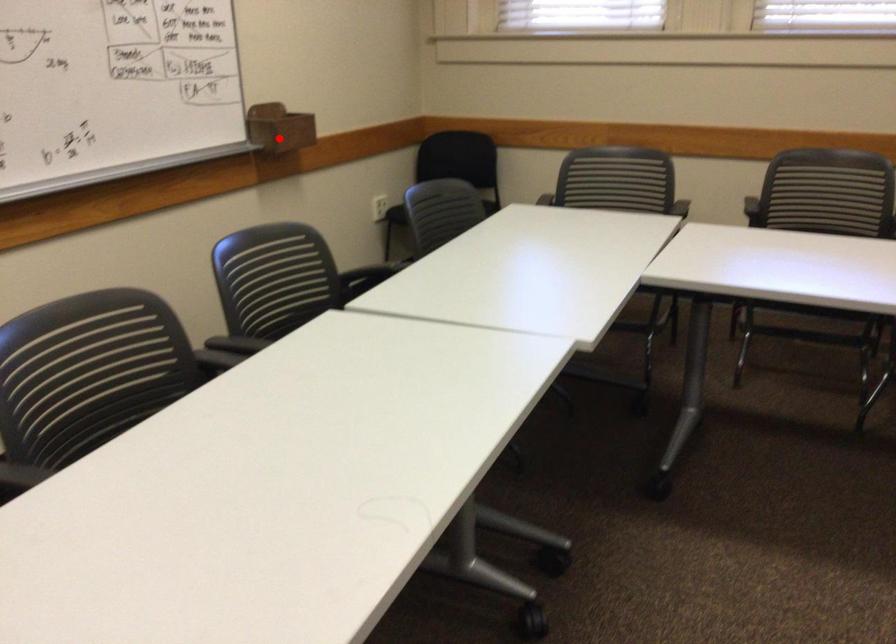
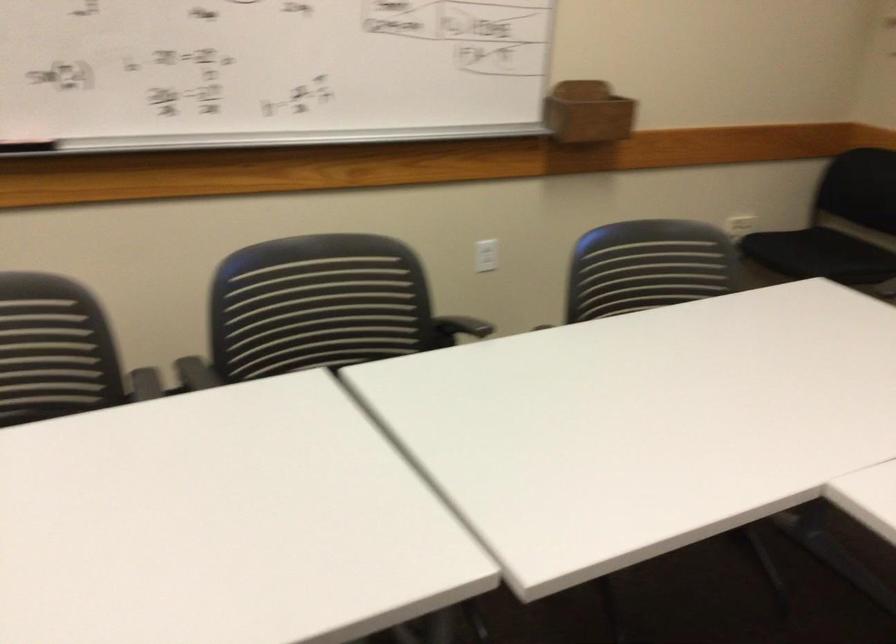
Find the pixel in the second image that matches the highlighted location in the first image.

(588, 111)